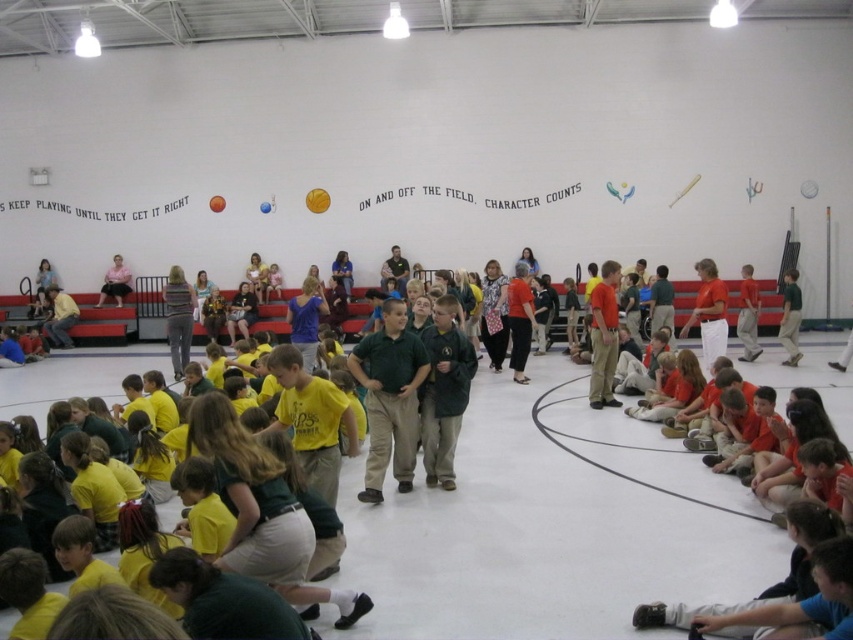
You are standing at the entrance of the gymnasium and see the point marked at coordinates (115,282). What object is located at that point?

The point at coordinates (115,282) corresponds to the pink fabric skirt at lower left.

You are a photographer standing at the back of the gymnasium. You want to take a photo of the khaki pants at center and the yellow rubber balloon at center. Which object should you focus on first if you want to capture both in the same frame without moving the camera?

The khaki pants at center is below the yellow rubber balloon at center, so you should focus on the yellow rubber balloon at center first since it is higher up and will be in focus if the pants are also in the frame.

You are a photographer standing at the back of the gymnasium. You want to take a photo that includes both the khaki pants at center and the yellow rubber balloon at center. Given that your camera has a maximum focus range of 14 meters, will you be able to capture both subjects in focus without moving closer?

The distance between the khaki pants at center and the yellow rubber balloon at center is 15.07 meters, which exceeds the camera maximum focus range of 14 meters. Therefore, you cannot capture both subjects in focus without moving closer.